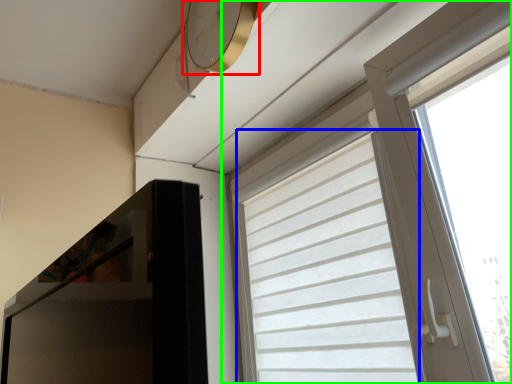
Question: Which object is positioned closest to clock (highlighted by a red box)? Select from curtain (highlighted by a blue box) and window (highlighted by a green box).

Choices:
 (A) curtain
 (B) window

Answer: (B)